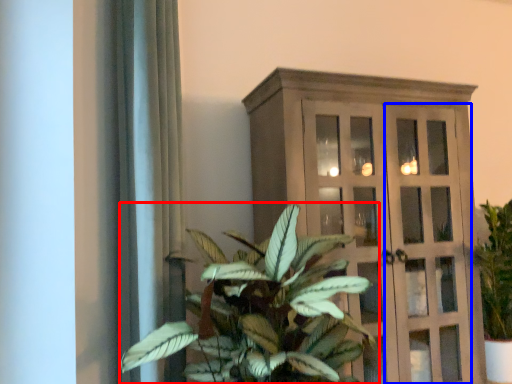
Question: Which of the following is the farthest to the observer, houseplant (highlighted by a red box) or screen door (highlighted by a blue box)?

Choices:
 (A) houseplant
 (B) screen door

Answer: (B)